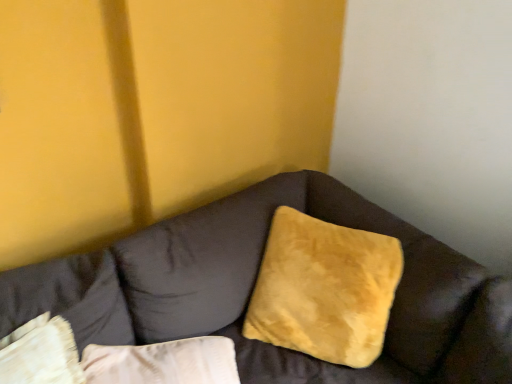
Question: Could velvet beige pillow at lower left, the 2th pillow viewed from the right, be considered to be inside suede yellow pillow at center, positioned as the first pillow in right-to-left order?

Choices:
 (A) yes
 (B) no

Answer: (B)

Question: Is suede yellow pillow at center, which ranks as the second pillow in left-to-right order, at the right side of velvet beige pillow at lower left, the 2th pillow viewed from the right?

Choices:
 (A) no
 (B) yes

Answer: (B)

Question: From a real-world perspective, is suede yellow pillow at center, which ranks as the second pillow in left-to-right order, on velvet beige pillow at lower left, which is counted as the first pillow, starting from the left?

Choices:
 (A) yes
 (B) no

Answer: (A)

Question: From the image's perspective, does suede yellow pillow at center, which ranks as the second pillow in left-to-right order, appear lower than velvet beige pillow at lower left, which is counted as the first pillow, starting from the left?

Choices:
 (A) no
 (B) yes

Answer: (A)

Question: Considering the relative sizes of suede yellow pillow at center, which ranks as the second pillow in left-to-right order, and velvet beige pillow at lower left, which is counted as the first pillow, starting from the left, in the image provided, is suede yellow pillow at center, which ranks as the second pillow in left-to-right order, smaller than velvet beige pillow at lower left, which is counted as the first pillow, starting from the left,?

Choices:
 (A) no
 (B) yes

Answer: (A)

Question: Is point (390, 286) closer or farther from the camera than point (10, 327)?

Choices:
 (A) farther
 (B) closer

Answer: (A)

Question: Is suede yellow pillow at center, which ranks as the second pillow in left-to-right order, bigger or smaller than velvet beige pillow at lower left, which is counted as the first pillow, starting from the left?

Choices:
 (A) small
 (B) big

Answer: (B)

Question: Is suede yellow pillow at center, positioned as the first pillow in right-to-left order, inside the boundaries of velvet beige pillow at lower left, which is counted as the first pillow, starting from the left, or outside?

Choices:
 (A) inside
 (B) outside

Answer: (B)

Question: From their relative heights in the image, would you say suede yellow pillow at center, positioned as the first pillow in right-to-left order, is taller or shorter than velvet beige pillow at lower left, which is counted as the first pillow, starting from the left?

Choices:
 (A) tall
 (B) short

Answer: (B)

Question: From a real-world perspective, is velvet beige pillow at lower left, which is counted as the first pillow, starting from the left, above or below suede yellow pillow at center, which ranks as the second pillow in left-to-right order?

Choices:
 (A) above
 (B) below

Answer: (B)

Question: Is velvet beige pillow at lower left, the 2th pillow viewed from the right, in front of or behind suede yellow pillow at center, which ranks as the second pillow in left-to-right order, in the image?

Choices:
 (A) front
 (B) behind

Answer: (A)

Question: In terms of width, does velvet beige pillow at lower left, which is counted as the first pillow, starting from the left, look wider or thinner when compared to suede yellow pillow at center, which ranks as the second pillow in left-to-right order?

Choices:
 (A) thin
 (B) wide

Answer: (A)

Question: Considering the relative positions of velvet beige pillow at lower left, the 2th pillow viewed from the right, and suede yellow pillow at center, which ranks as the second pillow in left-to-right order, in the image provided, is velvet beige pillow at lower left, the 2th pillow viewed from the right, to the left or to the right of suede yellow pillow at center, which ranks as the second pillow in left-to-right order,?

Choices:
 (A) left
 (B) right

Answer: (A)

Question: Considering their positions, is suede-like brown couch at center located in front of or behind velvet beige pillow at lower left, the 2th pillow viewed from the right?

Choices:
 (A) front
 (B) behind

Answer: (A)

Question: In the image, is suede-like brown couch at center on the left side or the right side of velvet beige pillow at lower left, the 2th pillow viewed from the right?

Choices:
 (A) right
 (B) left

Answer: (A)